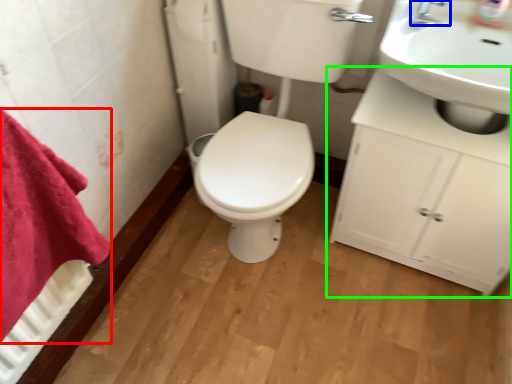
Question: Considering the real-world distances, which object is closest to bath towel (highlighted by a red box)? tap (highlighted by a blue box) or bathroom cabinet (highlighted by a green box).

Choices:
 (A) tap
 (B) bathroom cabinet

Answer: (B)